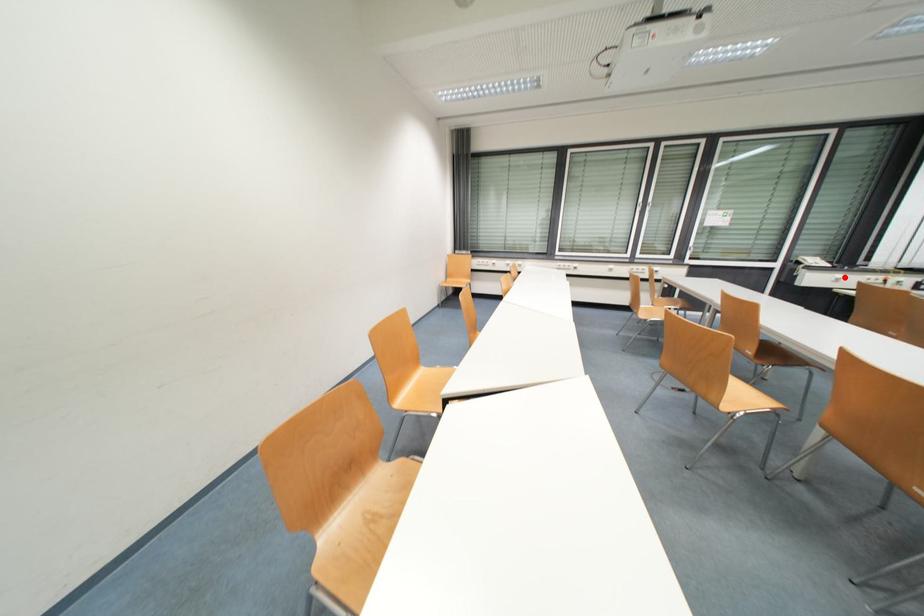
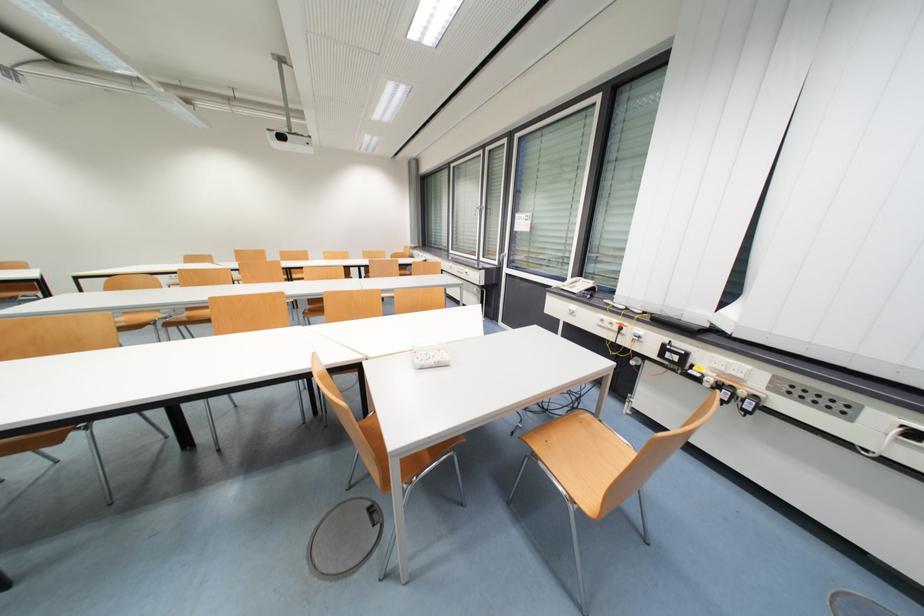
The point at the highlighted location is marked in the first image. Where is the corresponding point in the second image?

(578, 309)